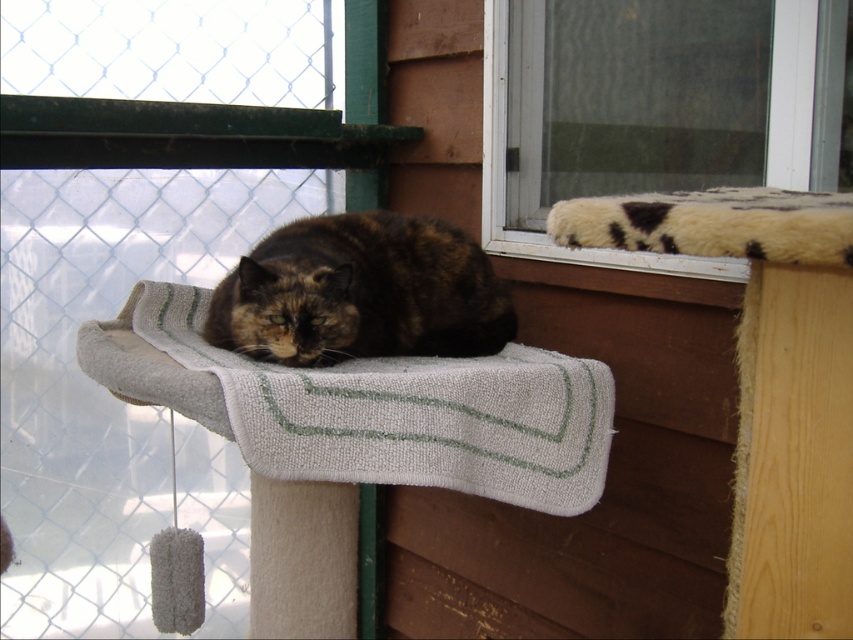
You are a small toy mouse that wants to jump from the white textured mat at center to the dark tortoiseshell fur at center. Considering the height difference between them, do you think you can land safely?

The white textured mat at center is much taller than the dark tortoiseshell fur at center, so the mouse can land safely by jumping downward from the white textured mat at center to the dark tortoiseshell fur at center.

You are a cat owner who wants to place a new toy on the fuzzy white cushion at upper right without disturbing the dark tortoiseshell fur at center. Can you reach the cushion from where the cat is currently resting?

The fuzzy white cushion at upper right is located above the dark tortoiseshell fur at center, so yes, you can reach the cushion from where the cat is resting as it is positioned above the cat.

You are a cat owner who wants to place a new toy on the fuzzy white cushion at upper right so your cat can reach it from the dark tortoiseshell fur at center. Considering their heights, will the cat need to jump up or climb down to reach the toy?

The fuzzy white cushion at upper right is much taller than the dark tortoiseshell fur at center, so the cat will need to jump up to reach the toy placed on the fuzzy white cushion at upper right.